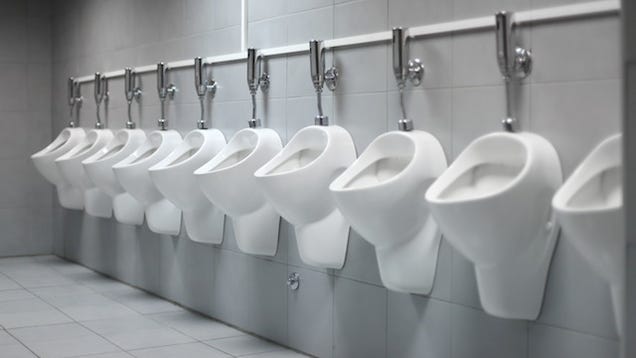
At what (x,y) coordinates should I click in order to perform the action: click on urinal. Please return your answer as a coordinate pair (x, y). Looking at the image, I should click on (43, 159), (64, 169), (99, 168), (134, 177), (176, 179), (245, 187), (300, 189), (422, 206), (506, 217), (591, 215).